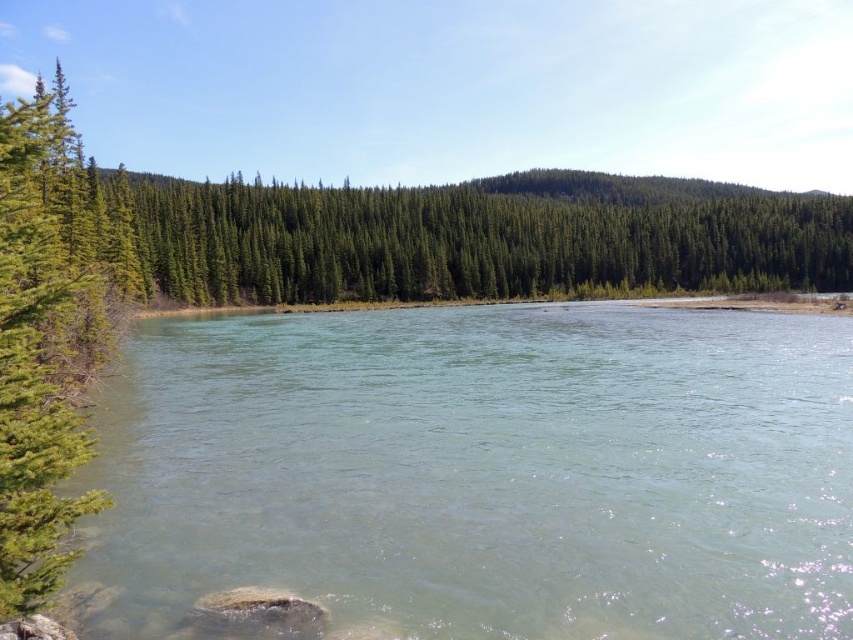
You are a hiker who wants to cross the river at the center. You see the clear water at center and the green textured pine tree at left. Which object is closer to the ground?

The clear water at center is located below green textured pine tree at left, so the clear water at center is closer to the ground.

Looking at this image, you are standing at the camera position observing the serene natural landscape with the wide river and coniferous trees. There is a point marked at coordinates point (677,192). Can you determine if this point is within the visible area of the river?

The point (677,192) is 353.45 meters from the camera. Since the river is the central feature of the landscape and spans across the scene, the point is likely within the visible area of the river.